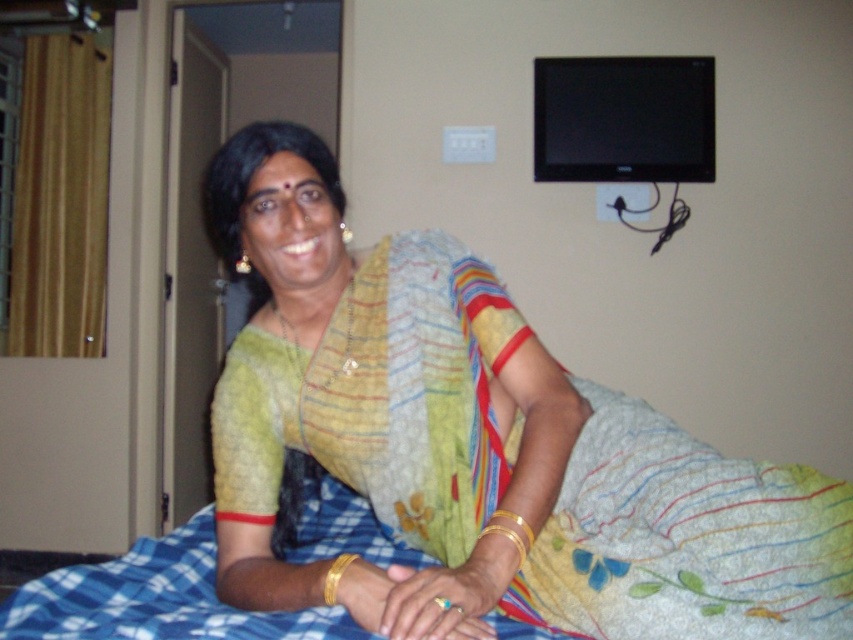
Question: Is matte yellow sari at center wider than blue checkered blanket at lower left?

Choices:
 (A) no
 (B) yes

Answer: (A)

Question: Which point is farther to the camera?

Choices:
 (A) blue checkered blanket at lower left
 (B) matte yellow sari at center

Answer: (B)

Question: Can you confirm if matte yellow sari at center is positioned below blue checkered blanket at lower left?

Choices:
 (A) no
 (B) yes

Answer: (A)

Question: Which object appears closest to the camera in this image?

Choices:
 (A) blue checkered blanket at lower left
 (B) matte yellow sari at center

Answer: (A)

Question: Is matte yellow sari at center thinner than blue checkered blanket at lower left?

Choices:
 (A) no
 (B) yes

Answer: (B)